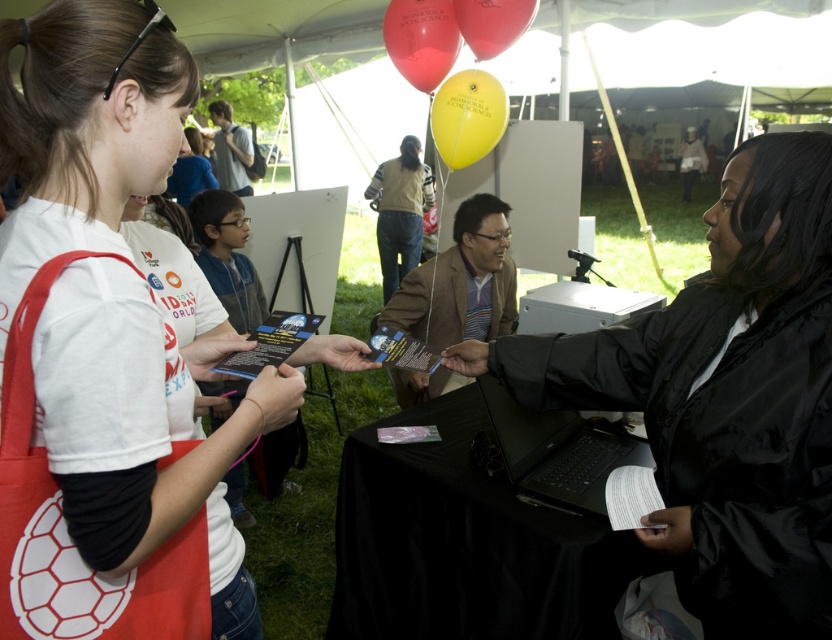
Question: Can you confirm if black matte jacket at center is positioned to the left of matte brown blazer at center?

Choices:
 (A) no
 (B) yes

Answer: (A)

Question: Which object is positioned closest to the black matte laptop at lower center?

Choices:
 (A) light brown sweater at center
 (B) yellow matte balloon at upper center

Answer: (B)

Question: Can you confirm if matte brown blazer at center is smaller than light brown shirt at upper center?

Choices:
 (A) yes
 (B) no

Answer: (A)

Question: Is yellow matte balloon at upper center to the right of light brown shirt at upper center from the viewer's perspective?

Choices:
 (A) no
 (B) yes

Answer: (B)

Question: Which object is the farthest from the light brown sweater at center?

Choices:
 (A) white matte t-shirt at upper left
 (B) rubberized yellow balloon at upper center
 (C) yellow matte balloon at upper center
 (D) rubberized red balloon at upper center

Answer: (A)

Question: Which object appears farthest from the camera in this image?

Choices:
 (A) rubberized yellow balloon at upper center
 (B) light brown shirt at upper center
 (C) black matte jacket at center

Answer: (B)